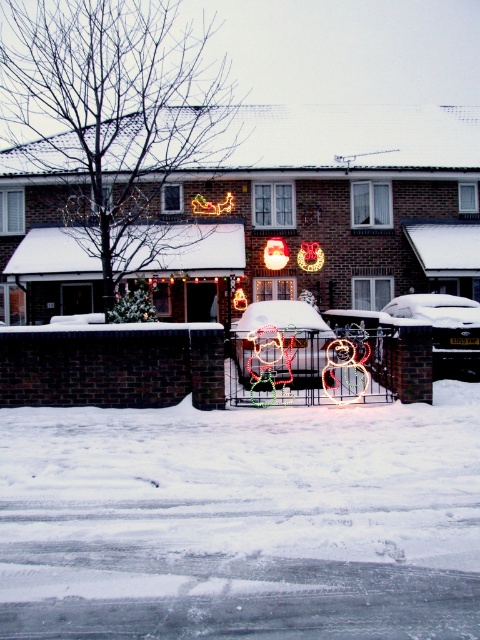
Does white fluffy snow at lower center have a greater width compared to neon santa at center?

No, white fluffy snow at lower center is not wider than neon santa at center.

Does white fluffy snow at lower center have a lesser height compared to neon santa at center?

Correct, white fluffy snow at lower center is not as tall as neon santa at center.

Is point (4, 426) more distant than point (243, 355)?

No, it is not.

Find the location of a particular element. This screenshot has height=640, width=480. white fluffy snow at lower center is located at coordinates (241, 522).

Who is taller, white fluffy snow at lower center or snow-covered car at center?

Standing taller between the two is snow-covered car at center.

Does white fluffy snow at lower center have a lesser width compared to snow-covered car at center?

Yes, white fluffy snow at lower center is thinner than snow-covered car at center.

What are the coordinates of `white fluffy snow at lower center` in the screenshot? It's located at (241, 522).

Which of these two, neon santa at center or snow-covered car at center, stands shorter?

neon santa at center is shorter.

How distant is neon santa at center from snow-covered car at center?

The distance of neon santa at center from snow-covered car at center is 9.06 feet.

What are the coordinates of `neon santa at center` in the screenshot? It's located at (280, 342).